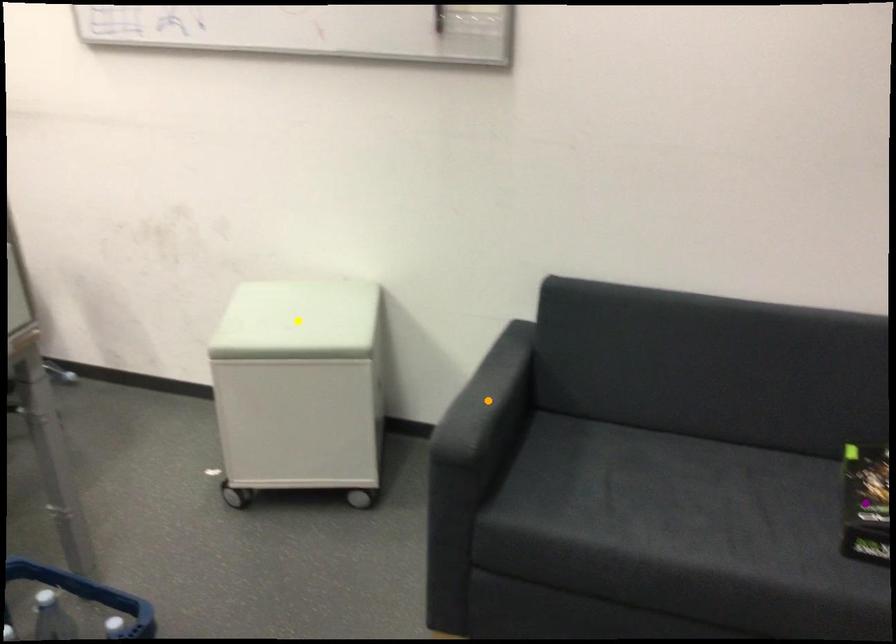
Order these from nearest to farthest:
orange point, purple point, yellow point

purple point < orange point < yellow point